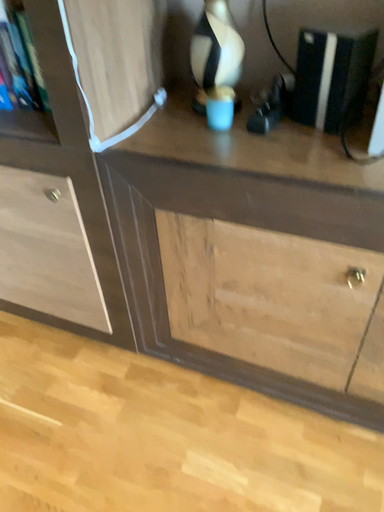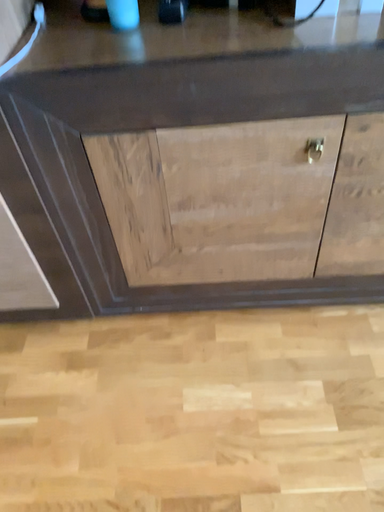
Question: Which way did the camera rotate in the video?

Choices:
 (A) rotated right
 (B) rotated left

Answer: (A)